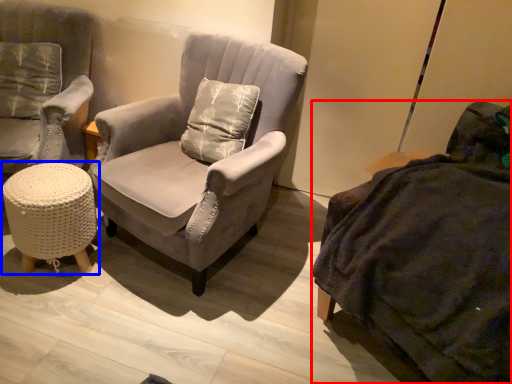
Question: Which point is closer to the camera, studio couch (highlighted by a red box) or table (highlighted by a blue box)?

Choices:
 (A) studio couch
 (B) table

Answer: (A)